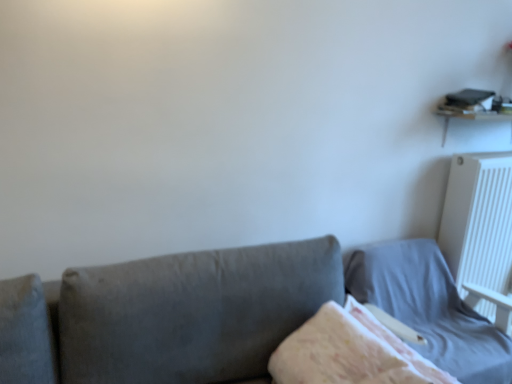
Question: Should I look upward or downward to see fluffy white blanket at center?

Choices:
 (A) up
 (B) down

Answer: (B)

Question: Could you tell me if light gray fabric bed at lower right is turned towards fluffy white blanket at center?

Choices:
 (A) yes
 (B) no

Answer: (A)

Question: Is fluffy white blanket at center inside light gray fabric bed at lower right?

Choices:
 (A) no
 (B) yes

Answer: (A)

Question: Is light gray fabric bed at lower right positioned in front of fluffy white blanket at center?

Choices:
 (A) yes
 (B) no

Answer: (B)

Question: Does light gray fabric bed at lower right have a greater height compared to fluffy white blanket at center?

Choices:
 (A) yes
 (B) no

Answer: (A)

Question: Is light gray fabric bed at lower right turned away from fluffy white blanket at center?

Choices:
 (A) no
 (B) yes

Answer: (A)

Question: From a real-world perspective, is light gray fabric bed at lower right positioned over fluffy white blanket at center based on gravity?

Choices:
 (A) yes
 (B) no

Answer: (B)

Question: From a real-world perspective, is fluffy white blanket at center located higher than white plastic radiator at upper right?

Choices:
 (A) yes
 (B) no

Answer: (B)

Question: Considering the relative positions of fluffy white blanket at center and white plastic radiator at upper right in the image provided, is fluffy white blanket at center to the left of white plastic radiator at upper right from the viewer's perspective?

Choices:
 (A) yes
 (B) no

Answer: (A)

Question: From a real-world perspective, is fluffy white blanket at center located beneath white plastic radiator at upper right?

Choices:
 (A) yes
 (B) no

Answer: (A)

Question: Can you confirm if fluffy white blanket at center is shorter than white plastic radiator at upper right?

Choices:
 (A) no
 (B) yes

Answer: (B)

Question: Does fluffy white blanket at center lie in front of white plastic radiator at upper right?

Choices:
 (A) no
 (B) yes

Answer: (B)

Question: From the image's perspective, is fluffy white blanket at center above white plastic radiator at upper right?

Choices:
 (A) no
 (B) yes

Answer: (A)

Question: Can you confirm if light gray fabric bed at lower right is positioned to the right of white plastic radiator at upper right?

Choices:
 (A) no
 (B) yes

Answer: (A)